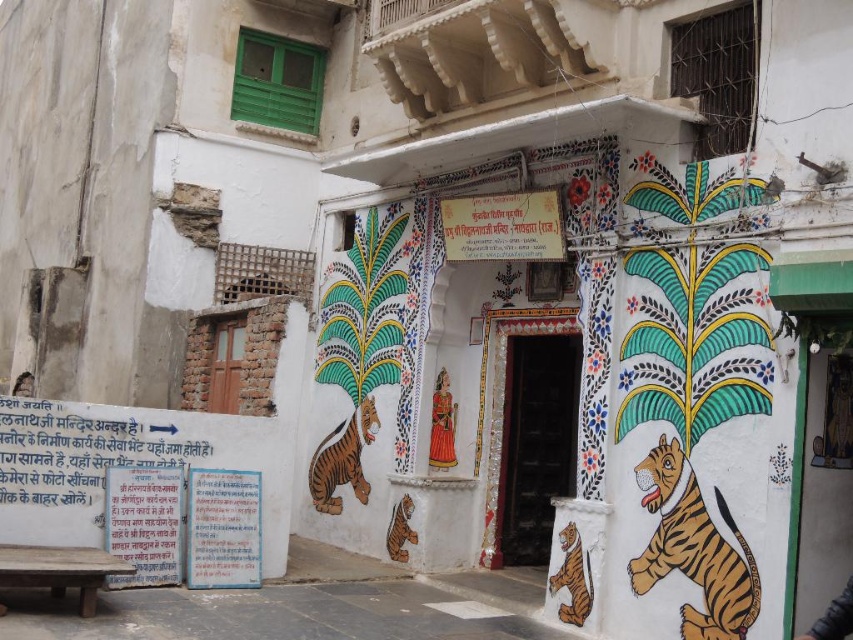
Who is lower down, polished wood statue at center or smooth skin face at lower left?

Positioned lower is polished wood statue at center.

The height and width of the screenshot is (640, 853). Find the location of `polished wood statue at center`. polished wood statue at center is located at coordinates (442, 424).

This screenshot has height=640, width=853. What are the coordinates of `polished wood statue at center` in the screenshot? It's located at (442, 424).

Find the location of `polished wood statue at center`. polished wood statue at center is located at coordinates (442, 424).